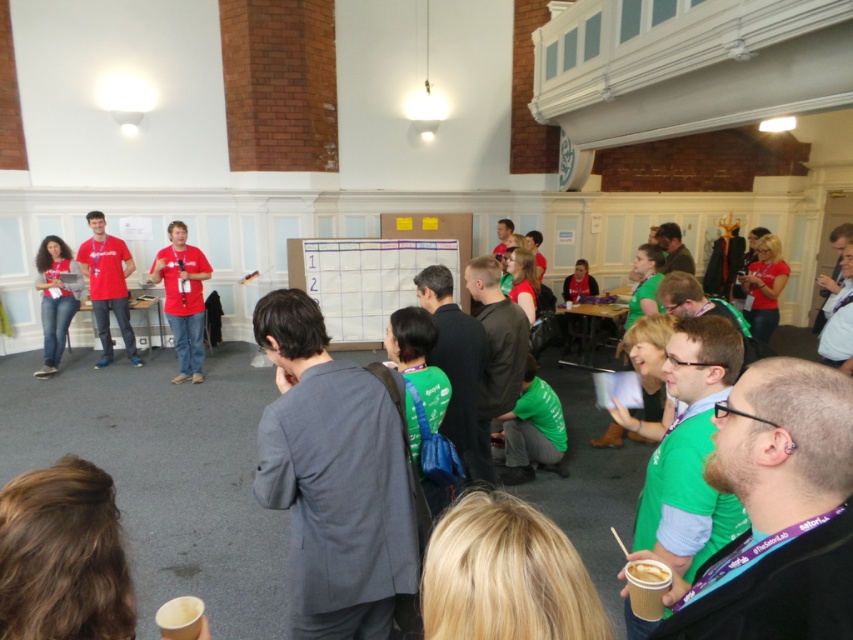
? Okay, let me try to work through this step by step. First, I need to understand the given information. The scene is an indoor gathering in a spacious hall with people, some in bright green shirts, and there are large windows and ceiling lights. The objects provided are a single point at coordinates (x=183, y=298) labeled as

? Wait, the user probably made a typo here. The Objects line says

You are standing in the front row of the gathering and want to take a photo of the two points mentioned. Which point, point (165, 262) or point (112, 292), will appear larger in the photo?

Point (165, 262) will appear larger in the photo because it is closer to the camera than point (112, 292).

You are an event planner who needs to ensure that all participants can see the speaker clearly. You notice the matte red shirt at left and jeans at left are blocking the view. Which one is taller and needs to be asked to move?

The matte red shirt at left is taller than jeans at left, so the matte red shirt at left needs to move to ensure a clear view.